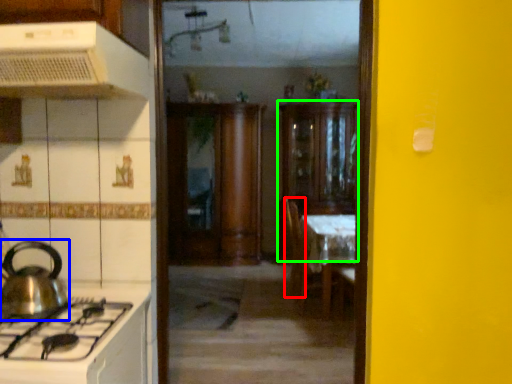
Question: Which is nearer to the chair (highlighted by a red box)? kitchen appliance (highlighted by a blue box) or cabinetry (highlighted by a green box).

Choices:
 (A) kitchen appliance
 (B) cabinetry

Answer: (B)